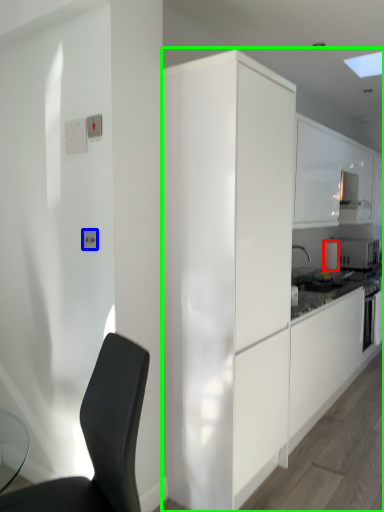
Question: Estimate the real-world distances between objects in this image. Which object is farther from appliance (highlighted by a red box), electric outlet (highlighted by a blue box) or cabinetry (highlighted by a green box)?

Choices:
 (A) electric outlet
 (B) cabinetry

Answer: (A)